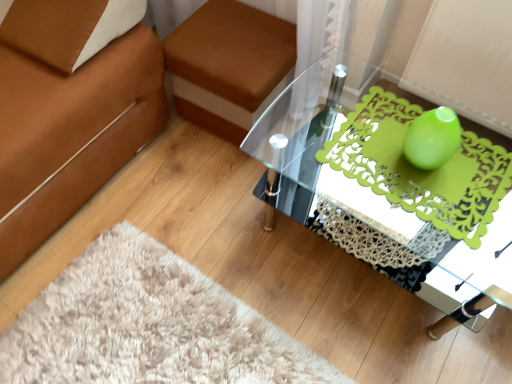
The height and width of the screenshot is (384, 512). I want to click on empty space that is ontop of transparent glass table at center (from a real-world perspective), so click(423, 169).